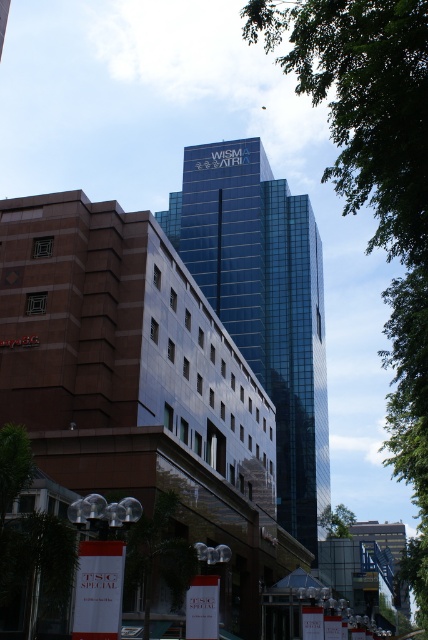
Is shiny glass tower at center bigger than green leafy tree at lower center?

Yes, shiny glass tower at center is bigger than green leafy tree at lower center.

The width and height of the screenshot is (428, 640). Identify the location of shiny glass tower at center. (264, 301).

Identify the location of shiny glass tower at center. Image resolution: width=428 pixels, height=640 pixels. (264, 301).

Can you confirm if shiny glass tower at center is thinner than green leafy tree at center?

Correct, shiny glass tower at center's width is less than green leafy tree at center's.

In the scene shown: Between shiny glass tower at center and green leafy tree at center, which one appears on the right side from the viewer's perspective?

From the viewer's perspective, green leafy tree at center appears more on the right side.

I want to click on shiny glass tower at center, so click(264, 301).

Between green leafy tree at upper right and green leafy tree at center, which one has less height?

green leafy tree at center is shorter.

Is point (404, 84) positioned in front of point (338, 534)?

Yes, point (404, 84) is closer to viewer.

At what (x,y) coordinates should I click in order to perform the action: click on green leafy tree at upper right. Please return your answer as a coordinate pair (x, y). Looking at the image, I should click on (377, 186).